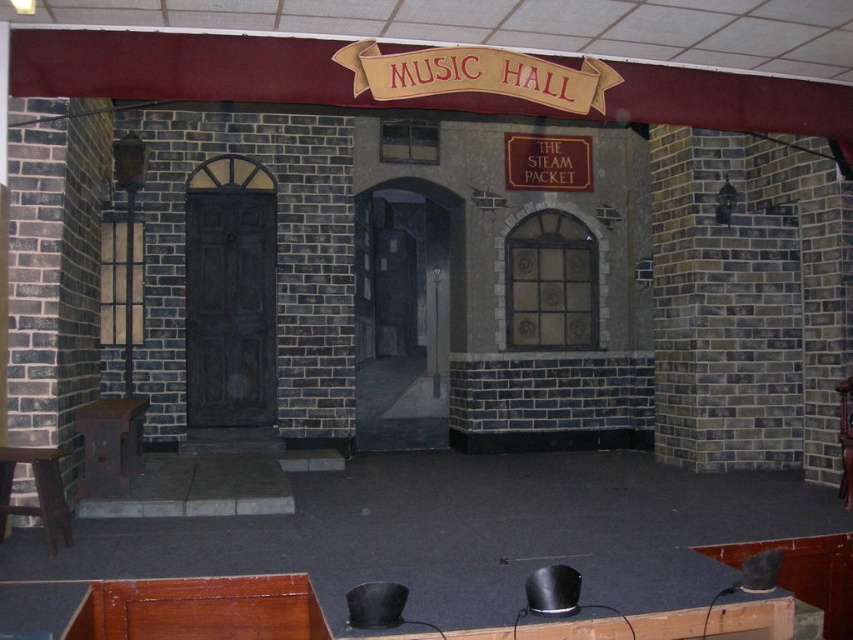
You are a stagehand setting up for a performance and need to place a 1.2 meter tall decoration. You see the rustic wood stool at lower left and the wooden stool at lower left. Which stool should you place the decoration on to ensure it is visible over both?

The rustic wood stool at lower left is taller than the wooden stool at lower left, so placing the decoration on the rustic wood stool at lower lower left will ensure it is visible over both.

You are a performer who needs to place a 1.2 meter wide costume box on the stage. Based on the image, can the smooth wooden floor at center accommodate the costume box without overlapping the wooden stool at lower left?

The smooth wooden floor at center might be wider than wooden stool at lower left, so it is possible that the smooth wooden floor at center can accommodate the 1.2 meter wide costume box without overlapping the wooden stool at lower left, but the exact width isn

You are a stagehand who needs to place a small potted plant exactly in the middle between the smooth wooden floor at center and rustic wood stool at lower left. Which object should you use as a reference point to ensure the plant is centered?

The smooth wooden floor at center is to the right of the rustic wood stool at lower left, so the center point between them would be halfway between the two objects. Use both the smooth wooden floor at center and rustic wood stool at lower left as reference points to determine the midpoint for placing the potted plant.